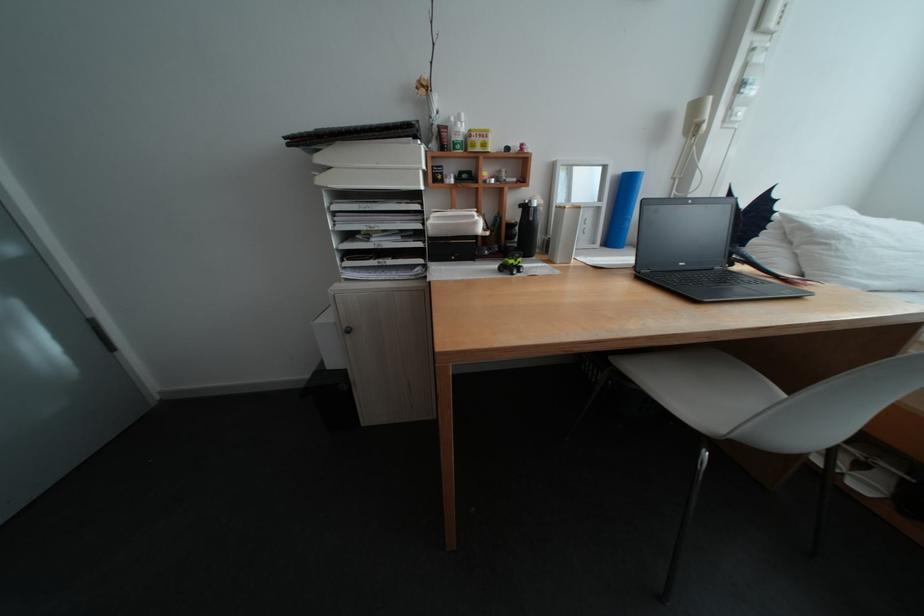
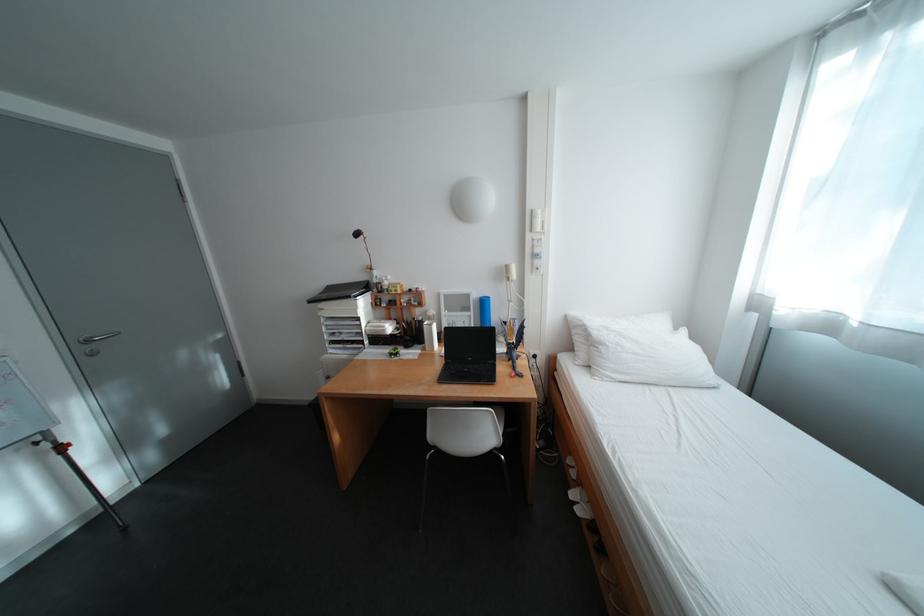
Locate, in the second image, the point that corresponds to (x=694, y=265) in the first image.

(481, 360)